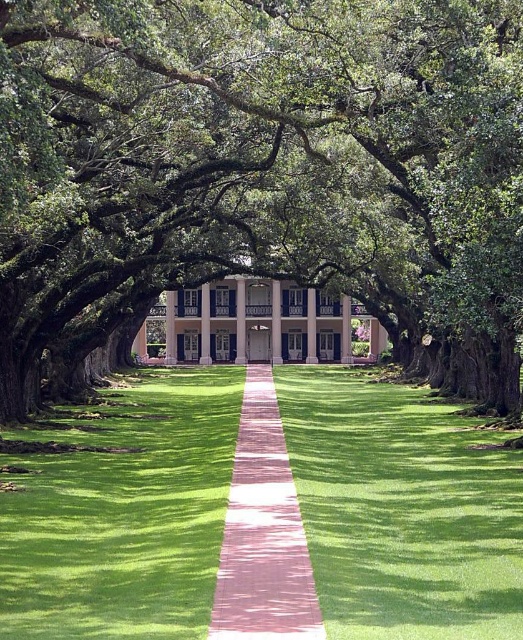
You are standing at the entrance of the mansion and want to walk to the point marked at coordinates (403, 509). According to the image description, what type of terrain will you be walking on?

The point marked at coordinates (403, 509) is on green grass at center, so you will be walking on green grass at center.

You are standing at the entrance of the mansion and want to walk to the point marked as point (381, 237). However, there is an obstacle at point (365, 490). Will you be able to walk directly to your destination without going around the obstacle?

Since point (381, 237) is behind point (365, 490), you will have to go around the obstacle at point (365, 490) to reach your destination.